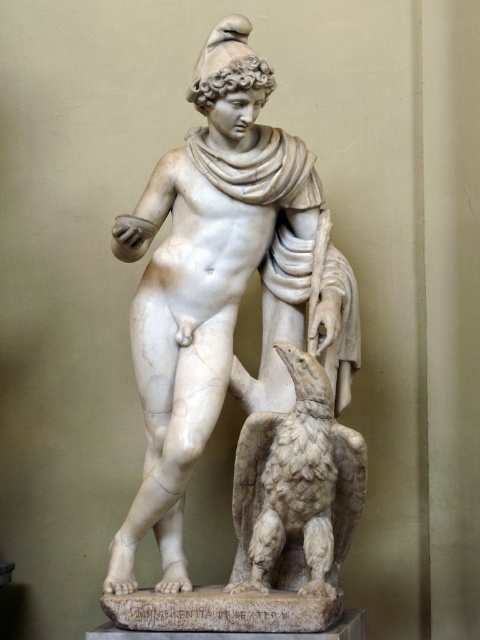
Question: Among these objects, which one is nearest to the camera?

Choices:
 (A) white marble bird at lower center
 (B) white marble statue at center

Answer: (A)

Question: Is white marble statue at center thinner than white marble bird at lower center?

Choices:
 (A) yes
 (B) no

Answer: (B)

Question: Does white marble statue at center appear on the left side of white marble bird at lower center?

Choices:
 (A) no
 (B) yes

Answer: (B)

Question: Does white marble statue at center have a larger size compared to white marble bird at lower center?

Choices:
 (A) no
 (B) yes

Answer: (B)